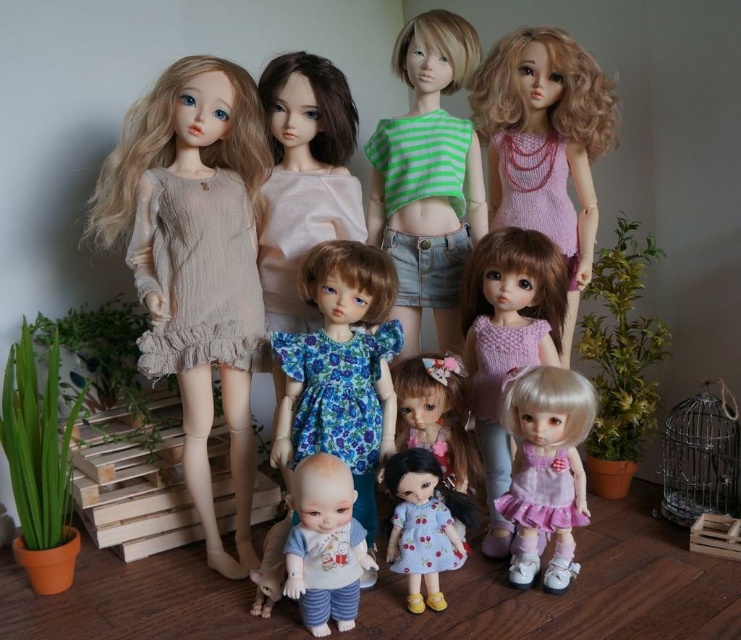
Does matte beige dress at upper left appear under blue floral dress at center?

Incorrect, matte beige dress at upper left is not positioned below blue floral dress at center.

Does matte beige dress at upper left come in front of blue floral dress at center?

No.

Where is `matte beige dress at upper left`? The width and height of the screenshot is (741, 640). matte beige dress at upper left is located at coordinates (485, 163).

Image resolution: width=741 pixels, height=640 pixels. Describe the element at coordinates (485, 163) in the screenshot. I see `matte beige dress at upper left` at that location.

From the picture: Does matte beige dress at upper left have a larger size compared to matte blue dress at center?

Indeed, matte beige dress at upper left has a larger size compared to matte blue dress at center.

At what (x,y) coordinates should I click in order to perform the action: click on matte beige dress at upper left. Please return your answer as a coordinate pair (x, y). Looking at the image, I should click on (485, 163).

Can you confirm if pastel pink fabric dress at lower right is positioned to the right of smooth beige baby doll at center?

Correct, you'll find pastel pink fabric dress at lower right to the right of smooth beige baby doll at center.

Which is more to the right, pastel pink fabric dress at lower right or smooth beige baby doll at center?

From the viewer's perspective, pastel pink fabric dress at lower right appears more on the right side.

This screenshot has height=640, width=741. Describe the element at coordinates (545, 468) in the screenshot. I see `pastel pink fabric dress at lower right` at that location.

Identify the location of pastel pink fabric dress at lower right. pyautogui.click(x=545, y=468).